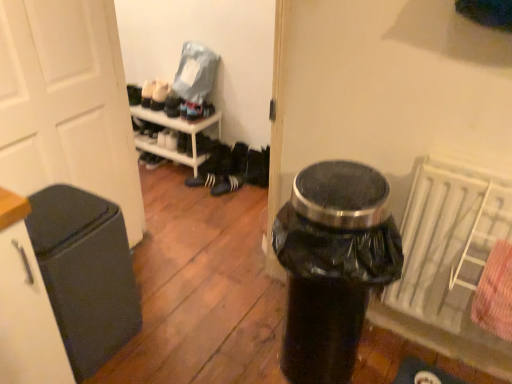
Find the location of a particular element. The height and width of the screenshot is (384, 512). blank area to the left of black matte sneakers at center, the second footwear from the right is located at coordinates (175, 171).